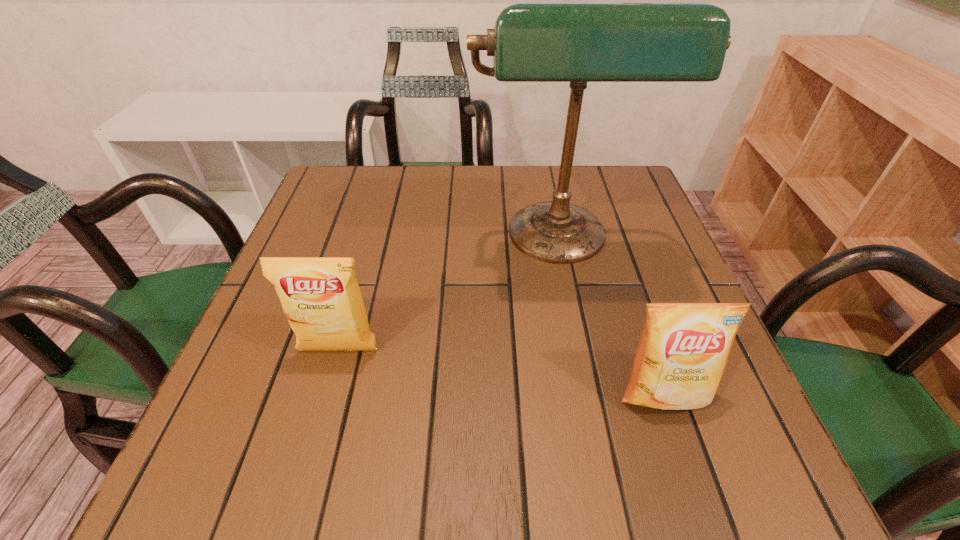
You are a GUI agent. You are given a task and a screenshot of the screen. Output one action in this format:
    pyautogui.click(x=<x>, y=<y>)
    Task: Click on the tallest object
    
    Given the screenshot: What is the action you would take?
    pyautogui.click(x=578, y=43)

Where is `table lamp`? table lamp is located at coordinates [578, 43].

Identify the location of the left crisp (potato chip). The width and height of the screenshot is (960, 540). (321, 298).

Where is `the farther crisp (potato chip)`? the farther crisp (potato chip) is located at coordinates (321, 298).

You are a GUI agent. You are given a task and a screenshot of the screen. Output one action in this format:
    pyautogui.click(x=<x>, y=<y>)
    Task: Click on the right crisp (potato chip)
    The height and width of the screenshot is (540, 960).
    Given the screenshot: What is the action you would take?
    pyautogui.click(x=683, y=352)

Where is `the nearest object`? The width and height of the screenshot is (960, 540). the nearest object is located at coordinates (683, 352).

Where is `free space located 0.330m above the green lampshade of the table lamp`? This screenshot has width=960, height=540. free space located 0.330m above the green lampshade of the table lamp is located at coordinates (601, 452).

Locate an element on the screen. free region located on the front of the second nearest object with the logo is located at coordinates (327, 393).

Where is `free location located on the front-facing side of the nearer crisp (potato chip)`? The height and width of the screenshot is (540, 960). free location located on the front-facing side of the nearer crisp (potato chip) is located at coordinates (683, 451).

The image size is (960, 540). What are the coordinates of `object located at the far edge` in the screenshot? It's located at (578, 43).